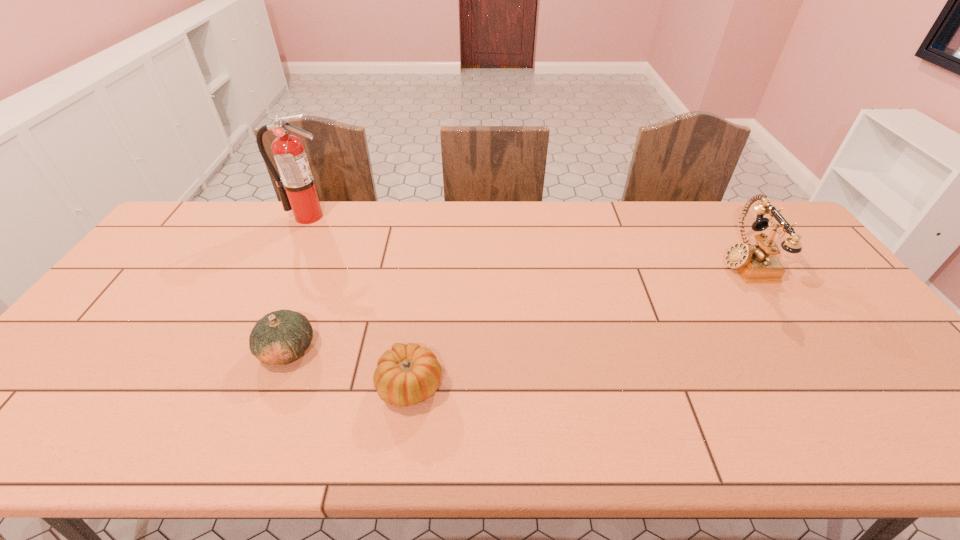
Locate an element on the screen. Image resolution: width=960 pixels, height=540 pixels. vacant point located between the taller gourd and the second tallest object is located at coordinates (516, 306).

Where is `free space between the shortest object and the farthest object`? The width and height of the screenshot is (960, 540). free space between the shortest object and the farthest object is located at coordinates (359, 301).

Find the location of a particular element. The image size is (960, 540). vacant space in between the right gourd and the left gourd is located at coordinates (349, 368).

Where is `free space that is in between the third object from left to right and the rightmost object`? free space that is in between the third object from left to right and the rightmost object is located at coordinates (577, 323).

Locate an element on the screen. Image resolution: width=960 pixels, height=540 pixels. free space between the right gourd and the third tallest object is located at coordinates (349, 368).

Identify which object is the second nearest to the third tallest object. Please provide its 2D coordinates. Your answer should be formatted as a tuple, i.e. [(x, y)], where the tuple contains the x and y coordinates of a point satisfying the conditions above.

[(296, 187)]

This screenshot has height=540, width=960. I want to click on object that is the closest to the tallest object, so 280,337.

The height and width of the screenshot is (540, 960). Identify the location of free location that satisfies the following two spatial constraints: 1. on the nozzle side of the second object from right to left; 2. on the right side of the fire extinguisher. (226, 386).

You are a GUI agent. You are given a task and a screenshot of the screen. Output one action in this format:
    pyautogui.click(x=<x>, y=<y>)
    Task: Click on the vacant space that satisfies the following two spatial constraints: 1. on the nozzle side of the tallest object; 2. on the left side of the shorter gourd
    The image size is (960, 540).
    Given the screenshot: What is the action you would take?
    [x=226, y=386]

Find the location of `free spot that satisfies the following two spatial constraints: 1. on the nozzle side of the fire extinguisher; 2. on the left side of the left gourd`. free spot that satisfies the following two spatial constraints: 1. on the nozzle side of the fire extinguisher; 2. on the left side of the left gourd is located at coordinates click(x=243, y=349).